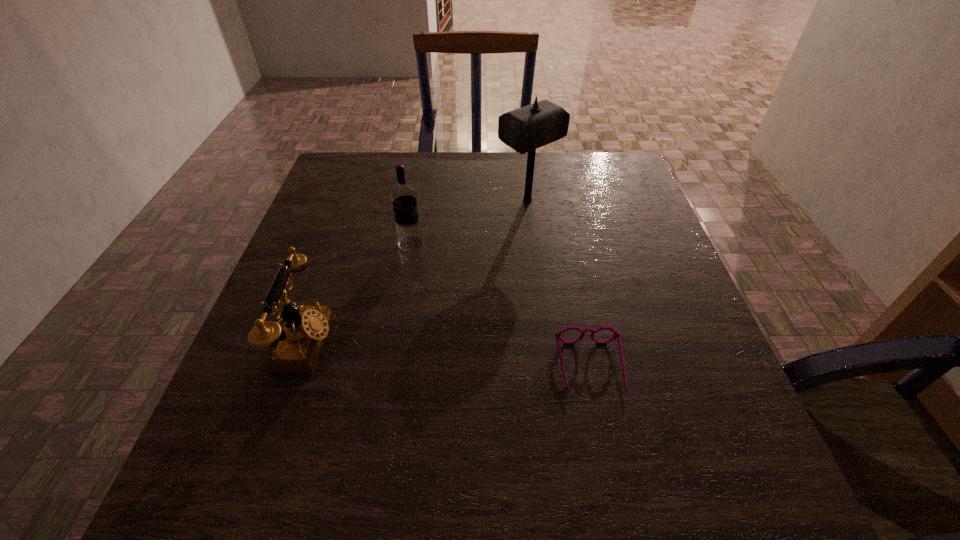
This screenshot has width=960, height=540. I want to click on mallet, so click(x=525, y=129).

Find the location of a particular element. The height and width of the screenshot is (540, 960). the tallest object is located at coordinates (525, 129).

Locate an element on the screen. vodka is located at coordinates (403, 196).

At what (x,y) coordinates should I click in order to perform the action: click on the second object from left to right. Please return your answer as a coordinate pair (x, y). Looking at the image, I should click on (403, 196).

You are a GUI agent. You are given a task and a screenshot of the screen. Output one action in this format:
    pyautogui.click(x=<x>, y=<y>)
    Task: Click on the second shortest object
    
    Given the screenshot: What is the action you would take?
    pyautogui.click(x=298, y=342)

Locate an element on the screen. the leftmost object is located at coordinates (298, 342).

Image resolution: width=960 pixels, height=540 pixels. I want to click on the shortest object, so (558, 336).

At what (x,y) coordinates should I click in order to perform the action: click on free spot located 0.200m on the left of the tallest object. Please return your answer as a coordinate pair (x, y). This screenshot has width=960, height=540. Looking at the image, I should click on (422, 200).

The height and width of the screenshot is (540, 960). I want to click on free space located on the label of the second tallest object, so click(449, 244).

Locate an element on the screen. The image size is (960, 540). vacant area located 0.230m on the dial of the telephone is located at coordinates (449, 342).